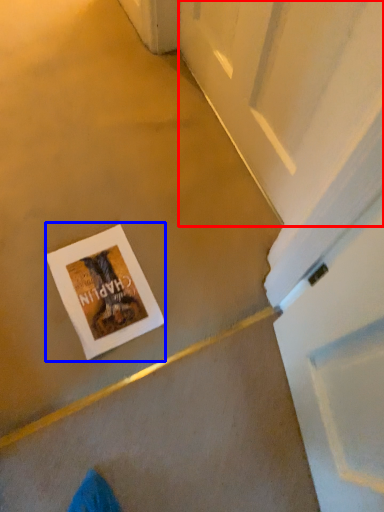
Question: Which point is closer to the camera, screen door (highlighted by a red box) or postcard (highlighted by a blue box)?

Choices:
 (A) screen door
 (B) postcard

Answer: (A)